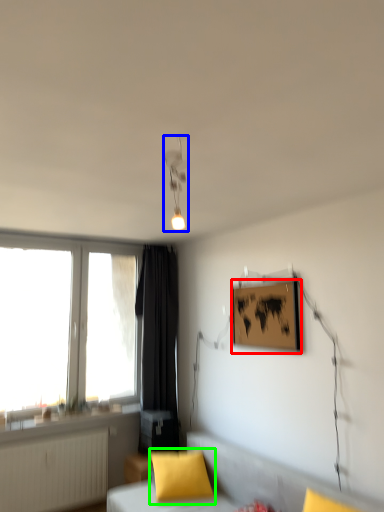
Question: Which object is the farthest from picture frame (highlighted by a red box)? Choose among these: light fixture (highlighted by a blue box) or pillow (highlighted by a green box).

Choices:
 (A) light fixture
 (B) pillow

Answer: (B)